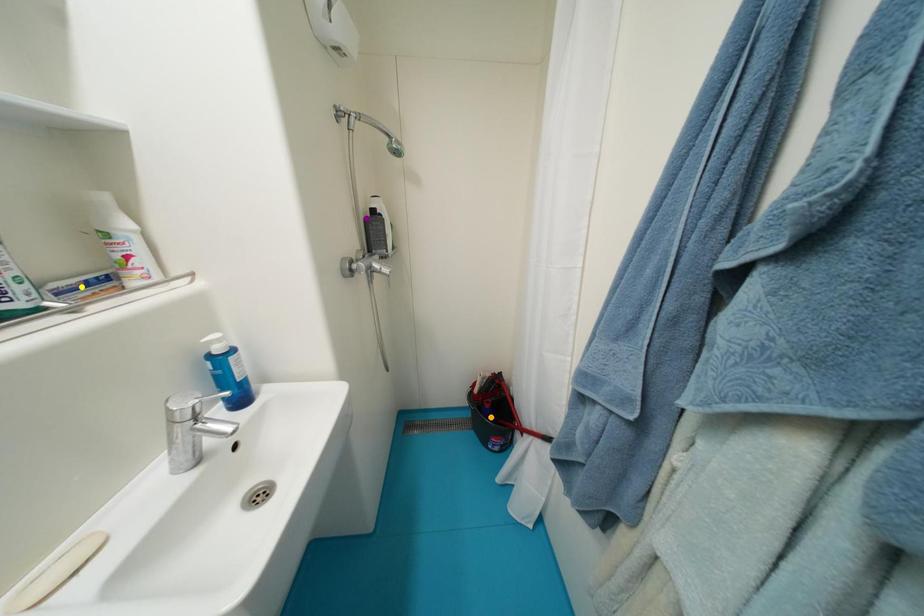
Order these from nearest to farthest:
orange point, purple point, yellow point

orange point, purple point, yellow point